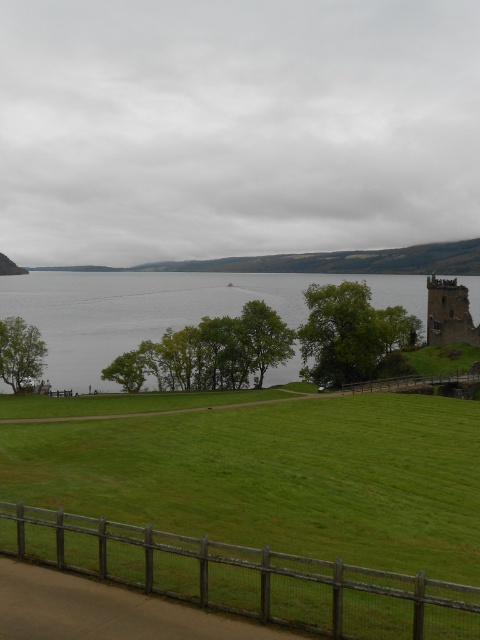
Based on the photo, is gray water at center to the left of brown stone castle at right from the viewer's perspective?

Indeed, gray water at center is positioned on the left side of brown stone castle at right.

Based on the photo, is gray water at center above brown stone castle at right?

Yes, gray water at center is above brown stone castle at right.

This screenshot has height=640, width=480. What do you see at coordinates (133, 310) in the screenshot? I see `gray water at center` at bounding box center [133, 310].

This screenshot has width=480, height=640. In order to click on gray water at center in this screenshot , I will do `click(133, 310)`.

Between wooden fence at lower center and brown stone castle at right, which one is positioned higher?

brown stone castle at right

What do you see at coordinates (244, 577) in the screenshot?
I see `wooden fence at lower center` at bounding box center [244, 577].

Is point (388, 595) less distant than point (454, 307)?

Yes.

Where is `wooden fence at lower center`? The image size is (480, 640). wooden fence at lower center is located at coordinates (244, 577).

Is brown stone castle at right thinner than wooden at right?

Yes, brown stone castle at right is thinner than wooden at right.

From the picture: Who is more forward, (446, 282) or (396, 381)?

Point (396, 381) is more forward.

Locate an element on the screen. This screenshot has width=480, height=640. brown stone castle at right is located at coordinates (448, 314).